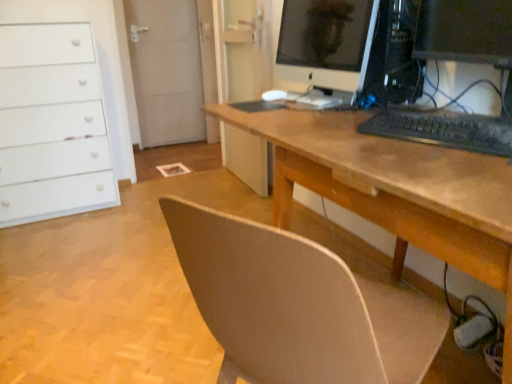
The width and height of the screenshot is (512, 384). Describe the element at coordinates (327, 44) in the screenshot. I see `matte black monitor at upper right` at that location.

Identify the location of black plastic keyboard at right. (458, 61).

Locate an element on the screen. wooden desk at center is located at coordinates (396, 190).

What do you see at coordinates (50, 114) in the screenshot?
I see `white matte chest of drawers at left` at bounding box center [50, 114].

Image resolution: width=512 pixels, height=384 pixels. Find the location of `matte black monitor at upper right`. matte black monitor at upper right is located at coordinates (327, 44).

Can you confirm if white matte chest of drawers at left is positioned to the left of wooden desk at center?

Correct, you'll find white matte chest of drawers at left to the left of wooden desk at center.

Which of these two, white matte chest of drawers at left or wooden desk at center, stands taller?

Standing taller between the two is white matte chest of drawers at left.

How distant is white matte chest of drawers at left from wooden desk at center?

white matte chest of drawers at left is 5.09 feet away from wooden desk at center.

Identify the location of chest of drawers above the wooden desk at center (from a real-world perspective). The image size is (512, 384). (50, 114).

In the image, is black plastic keyboard at right positioned in front of or behind black matte keyboard at center?

Visually, black plastic keyboard at right is located behind black matte keyboard at center.

Which point is more forward, (x=509, y=80) or (x=380, y=116)?

The point (x=380, y=116) is more forward.

From the picture: Is black plastic keyboard at right situated inside black matte keyboard at center or outside?

black plastic keyboard at right lies outside black matte keyboard at center.

Would you say matte black monitor at upper right is inside or outside white matte chest of drawers at left?

matte black monitor at upper right lies outside white matte chest of drawers at left.

Consider the image. Is matte black monitor at upper right turned away from white matte chest of drawers at left?

No, matte black monitor at upper right is not facing away from white matte chest of drawers at left.

Is satin black monitor at center looking in the opposite direction of white matte chest of drawers at left?

No, satin black monitor at center's orientation is not away from white matte chest of drawers at left.

Between point (400, 70) and point (64, 71), which one is positioned in front?

The point (400, 70) is closer.

Considering the relative sizes of satin black monitor at center and white matte chest of drawers at left in the image provided, is satin black monitor at center thinner than white matte chest of drawers at left?

Yes, satin black monitor at center is thinner than white matte chest of drawers at left.

From a real-world perspective, is satin black monitor at center positioned above or below white matte chest of drawers at left?

satin black monitor at center is above white matte chest of drawers at left.

From a real-world perspective, is satin black monitor at center above or below black plastic keyboard at right?

satin black monitor at center is above black plastic keyboard at right.

Is satin black monitor at center turned away from black plastic keyboard at right?

satin black monitor at center does not have its back to black plastic keyboard at right.

Is satin black monitor at center not within black plastic keyboard at right?

Absolutely, satin black monitor at center is external to black plastic keyboard at right.

From a real-world perspective, is matte black monitor at upper right positioned over satin black monitor at center based on gravity?

No.

Is matte black monitor at upper right taller than satin black monitor at center?

Yes, matte black monitor at upper right is taller than satin black monitor at center.

Would you say matte black monitor at upper right is a long distance from satin black monitor at center?

That's not correct — matte black monitor at upper right is a little close to satin black monitor at center.

Is black plastic keyboard at right thinner than wooden desk at center?

Indeed, black plastic keyboard at right has a lesser width compared to wooden desk at center.

Is black plastic keyboard at right smaller than wooden desk at center?

Yes, black plastic keyboard at right is smaller than wooden desk at center.

Is black plastic keyboard at right to the left of wooden desk at center from the viewer's perspective?

No.

This screenshot has height=384, width=512. I want to click on desk in front of the white matte chest of drawers at left, so click(x=396, y=190).

The height and width of the screenshot is (384, 512). In order to click on computer above the black matte keyboard at center (from the image's perspective) in this screenshot , I will do `click(458, 61)`.

Which object lies further to the anchor point wooden desk at center, black matte keyboard at center or matte black monitor at upper right?

matte black monitor at upper right lies further to wooden desk at center than the other object.

Considering their positions, is black matte keyboard at center positioned closer to wooden desk at center than satin black monitor at center?

black matte keyboard at center lies closer to wooden desk at center than the other object.

Considering their positions, is matte black monitor at upper right positioned further to black matte keyboard at center than satin black monitor at center?

matte black monitor at upper right.

In the scene shown: When comparing their distances from satin black monitor at center, does wooden desk at center or white matte chest of drawers at left seem closer?

wooden desk at center.

Estimate the real-world distances between objects in this image. Which object is further from satin black monitor at center, white matte chest of drawers at left or black matte keyboard at center?

white matte chest of drawers at left is further to satin black monitor at center.

Based on their spatial positions, is matte black monitor at upper right or wooden desk at center further from black plastic keyboard at right?

The object further to black plastic keyboard at right is matte black monitor at upper right.

Which object lies further to the anchor point black matte keyboard at center, black plastic keyboard at right or matte black monitor at upper right?

Based on the image, matte black monitor at upper right appears to be further to black matte keyboard at center.

When comparing their distances from white matte chest of drawers at left, does wooden desk at center or black plastic keyboard at right seem closer?

The object closer to white matte chest of drawers at left is wooden desk at center.

You are a GUI agent. You are given a task and a screenshot of the screen. Output one action in this format:
    pyautogui.click(x=<x>, y=<y>)
    Task: Click on the keyboard located between wooden desk at center and matte black monitor at upper right in the depth direction
    The image size is (512, 384).
    Given the screenshot: What is the action you would take?
    pyautogui.click(x=443, y=130)

Where is `keyboard between wooden desk at center and satin black monitor at center in the front-back direction`? Image resolution: width=512 pixels, height=384 pixels. keyboard between wooden desk at center and satin black monitor at center in the front-back direction is located at coordinates (443, 130).

You are a GUI agent. You are given a task and a screenshot of the screen. Output one action in this format:
    pyautogui.click(x=<x>, y=<y>)
    Task: Click on the computer monitor between black matte keyboard at center and satin black monitor at center in the front-back direction
    
    Given the screenshot: What is the action you would take?
    pyautogui.click(x=327, y=44)

At what (x,y) coordinates should I click in order to perform the action: click on desk between white matte chest of drawers at left and satin black monitor at center from left to right. Please return your answer as a coordinate pair (x, y). The image size is (512, 384). Looking at the image, I should click on (x=396, y=190).